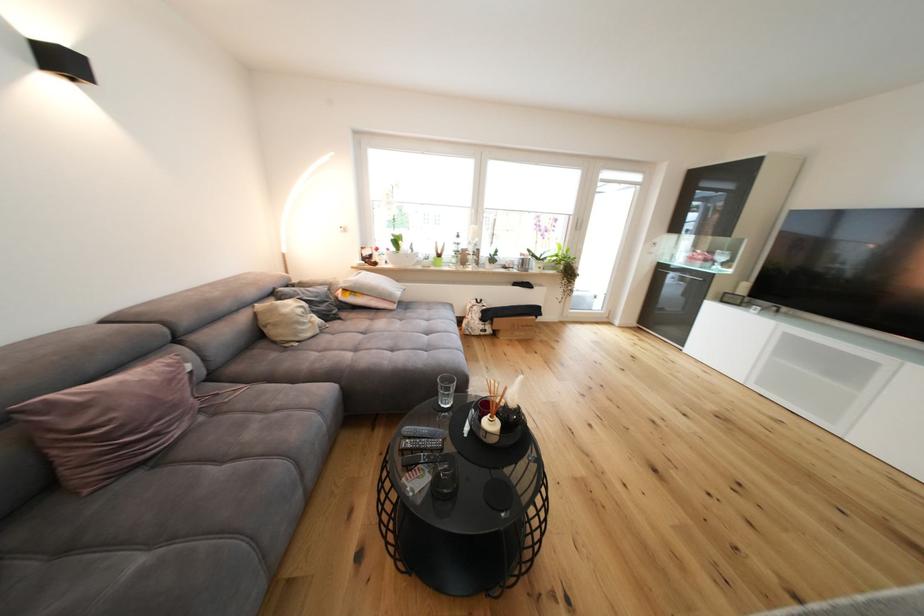
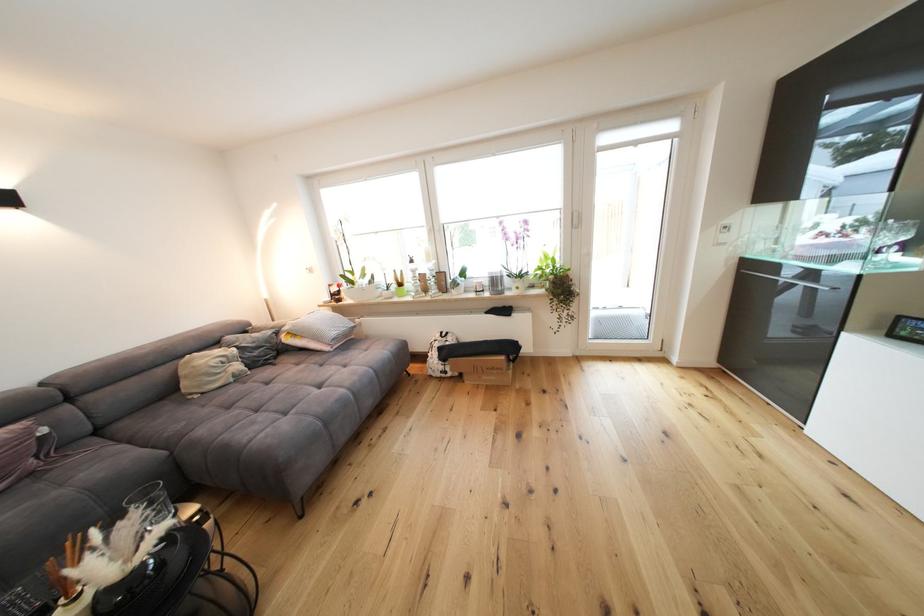
In a continuous first-person perspective shot, in which direction is the camera moving?

The movement direction of the cameraman is right, forward.